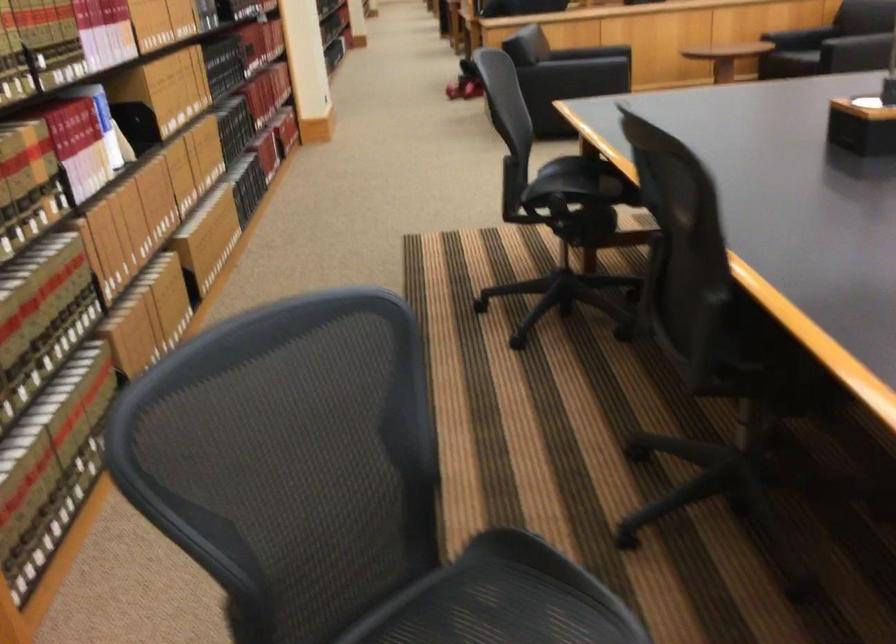
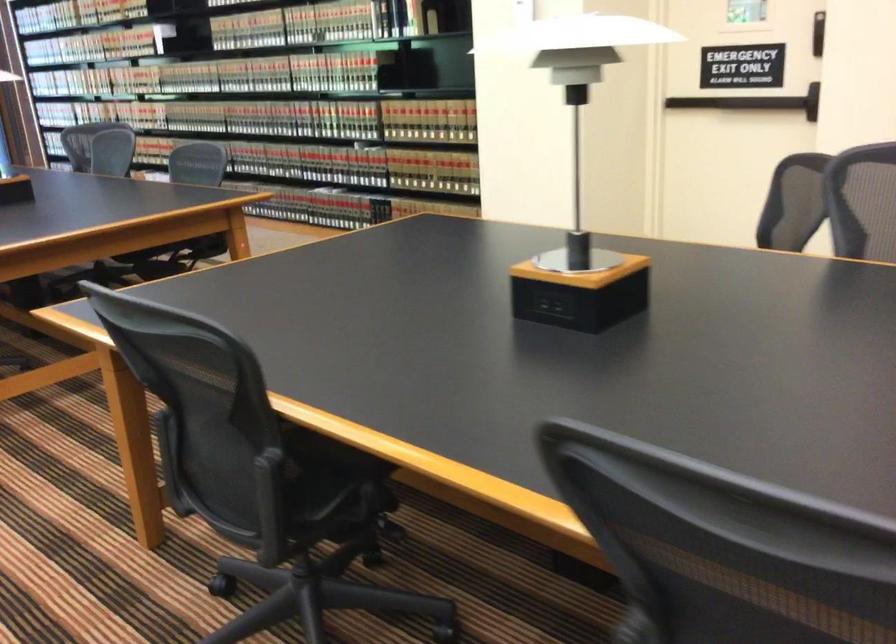
Question: I am providing you with two images of the same scene from different viewpoints. After the viewpoint changes to image2, which objects are now occluded?

Choices:
 (A) black door handle
 (B) library book
 (C) black chair sitting surface
 (D) yellow pitcher handle

Answer: (C)